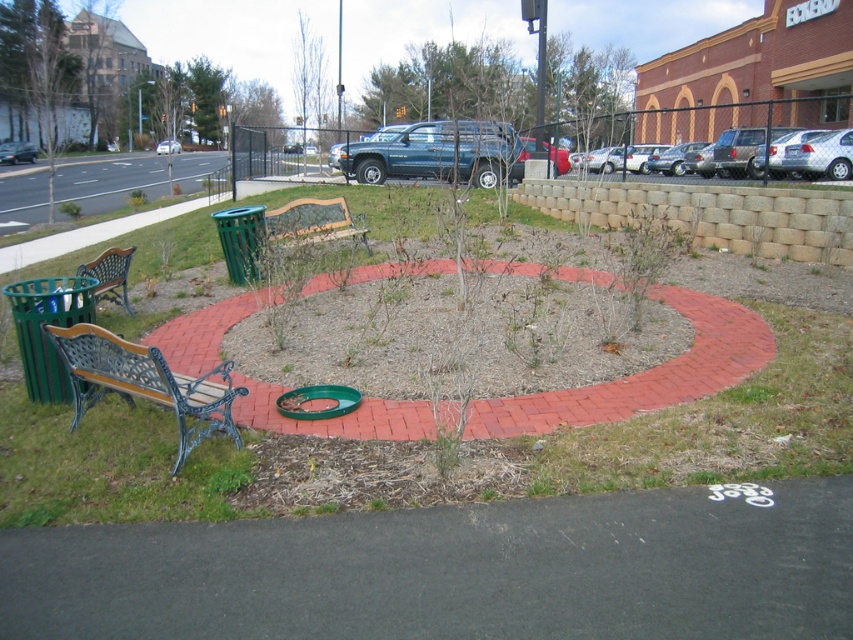
Who is higher up, green grass at lower left or wooden bench at lower left?

green grass at lower left

Locate an element on the screen. The image size is (853, 640). green grass at lower left is located at coordinates (431, 445).

I want to click on green grass at lower left, so click(x=431, y=445).

How far apart are green plastic circle at center and green metal bench at left?

green plastic circle at center is 3.14 meters from green metal bench at left.

Does green plastic circle at center have a greater height compared to green metal bench at left?

No, green plastic circle at center is not taller than green metal bench at left.

Who is more forward, (299, 406) or (99, 289)?

Positioned in front is point (299, 406).

Where is `green plastic circle at center`? This screenshot has width=853, height=640. green plastic circle at center is located at coordinates [318, 403].

Is point (67, 371) less distant than point (279, 240)?

Yes, point (67, 371) is closer to viewer.

Is wooden bench at lower left smaller than wooden bench at center?

Yes.

Where is `wooden bench at lower left`? wooden bench at lower left is located at coordinates (144, 381).

Locate an element on the screen. This screenshot has width=853, height=640. wooden bench at lower left is located at coordinates (144, 381).